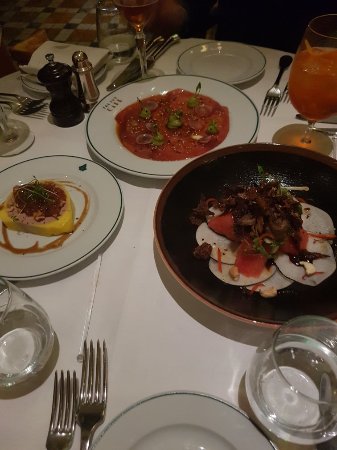
You are a GUI agent. You are given a task and a screenshot of the screen. Output one action in this format:
    pyautogui.click(x=<x>, y=<y>)
    Task: Click on the water glass
    The image size is (337, 450).
    Given the screenshot: What is the action you would take?
    pyautogui.click(x=291, y=407), pyautogui.click(x=37, y=355)